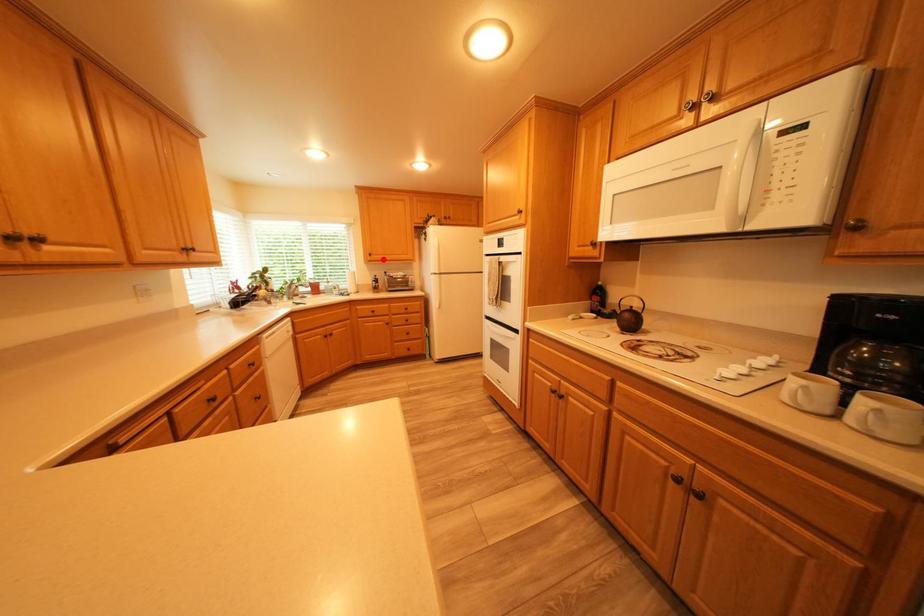
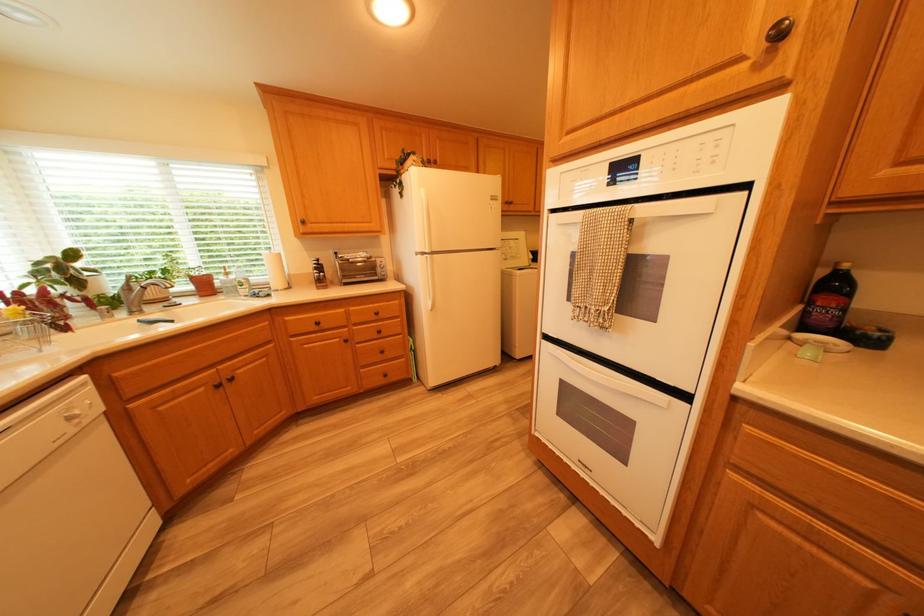
Locate, in the second image, the point that corresponds to the highlighted location in the first image.

(317, 230)